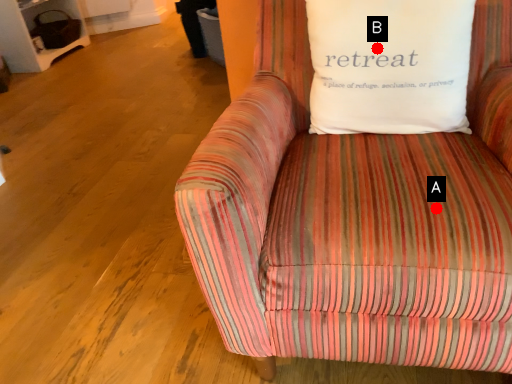
Question: Two points are circled on the image, labeled by A and B beside each circle. Among these points, which one is farthest from the camera?

Choices:
 (A) A is further
 (B) B is further

Answer: (B)